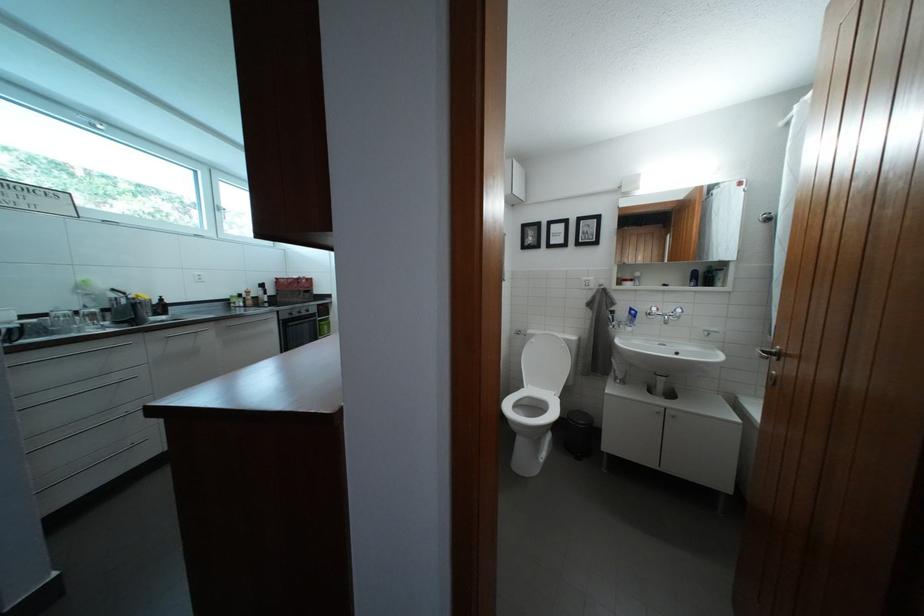
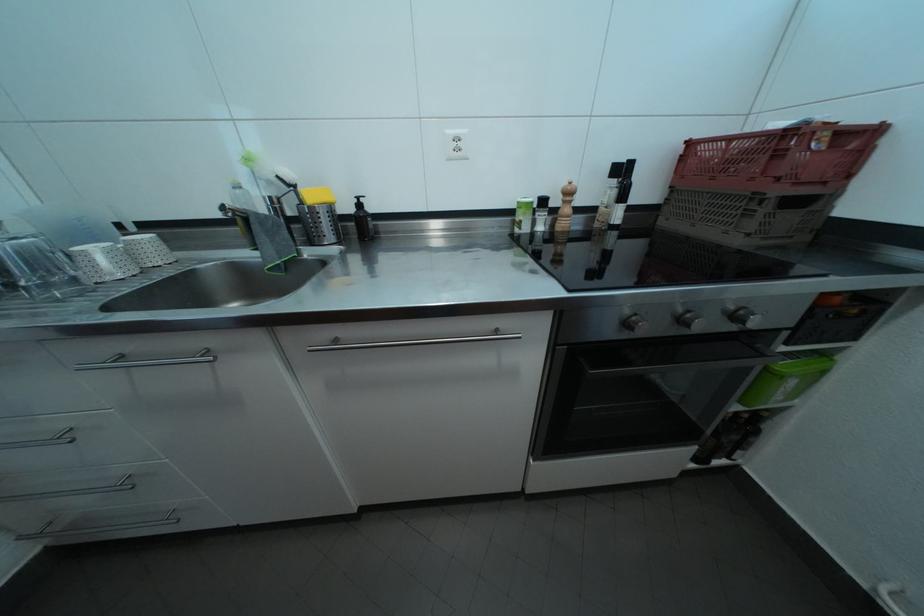
The point at (272, 292) is marked in the first image. Where is the corresponding point in the second image?

(630, 176)